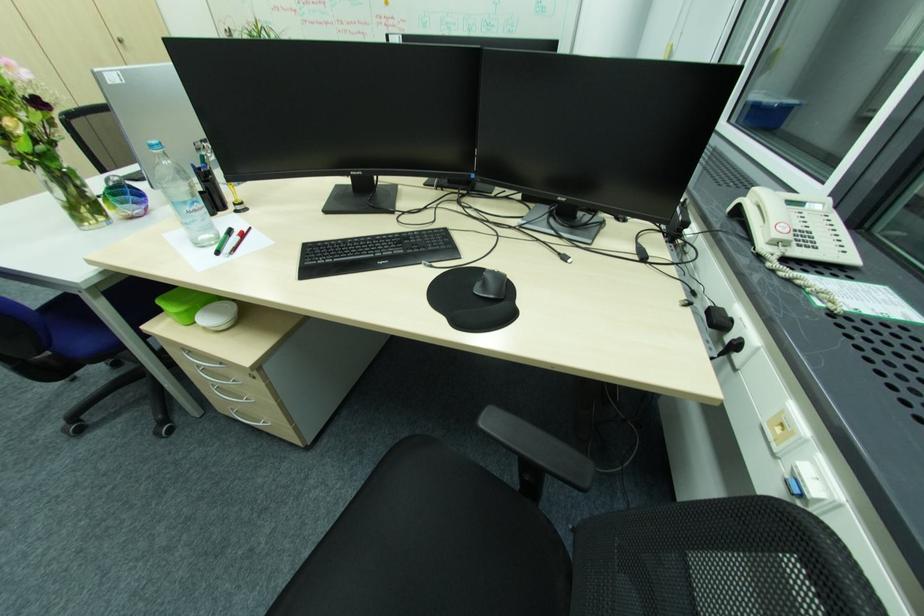
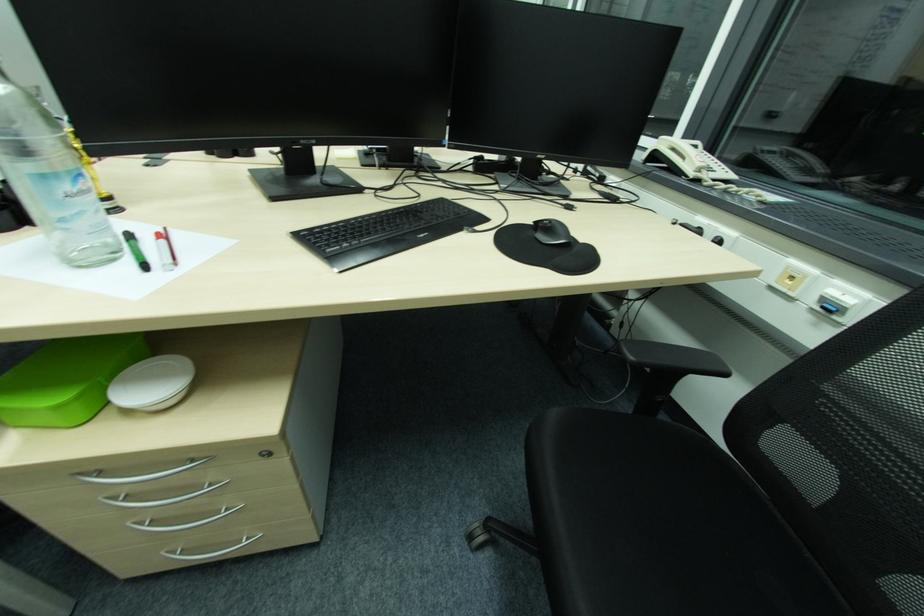
In the second image, find the point that corresponds to (x=226, y=363) in the first image.

(199, 460)